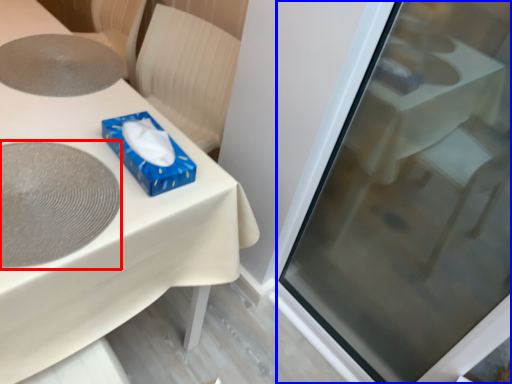
Question: Which point is further to the camera, oval (highlighted by a red box) or screen door (highlighted by a blue box)?

Choices:
 (A) oval
 (B) screen door

Answer: (A)